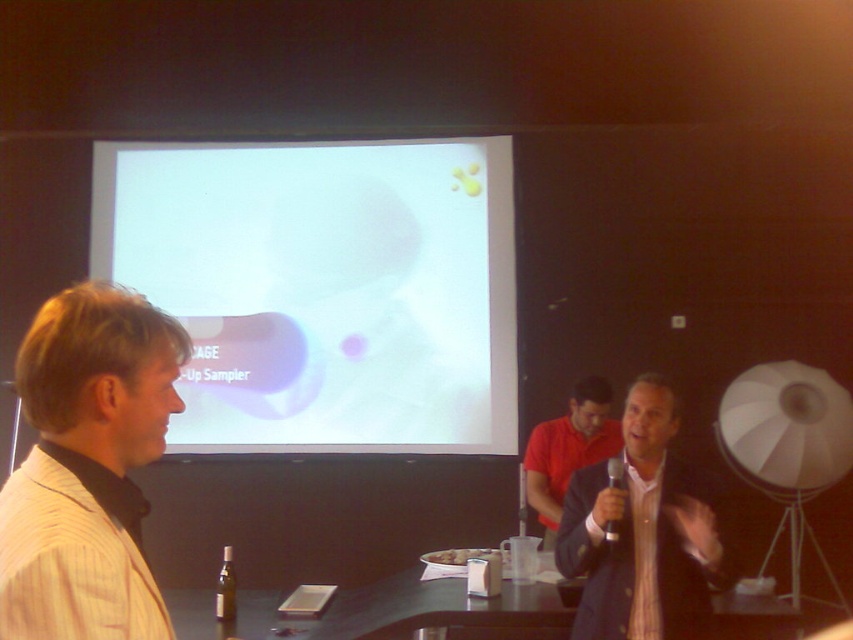
Question: Can you confirm if white glossy projection screen at upper center is thinner than light beige striped shirt at left?

Choices:
 (A) yes
 (B) no

Answer: (B)

Question: Estimate the real-world distances between objects in this image. Which object is closer to the white glossy projection screen at upper center?

Choices:
 (A) light beige striped shirt at left
 (B) matte black suit at center

Answer: (B)

Question: Which of the following is the farthest from the observer?

Choices:
 (A) light beige striped shirt at left
 (B) white glossy projection screen at upper center
 (C) red matte shirt at center

Answer: (B)

Question: Is white glossy projection screen at upper center below matte black suit at center?

Choices:
 (A) no
 (B) yes

Answer: (A)

Question: Can you confirm if white glossy projection screen at upper center is positioned above red matte shirt at center?

Choices:
 (A) no
 (B) yes

Answer: (B)

Question: Among these points, which one is farthest from the camera?

Choices:
 (A) (328, 193)
 (B) (699, 534)
 (C) (573, 444)

Answer: (A)